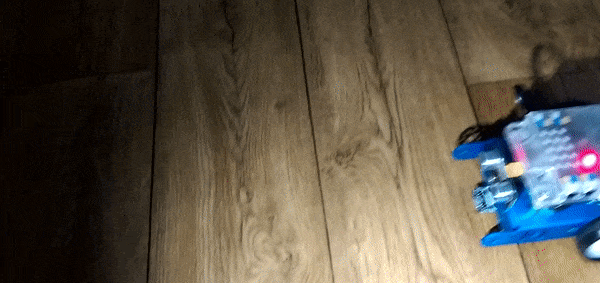
What are the coordinates of `remote` in the screenshot? It's located at (131, 218).